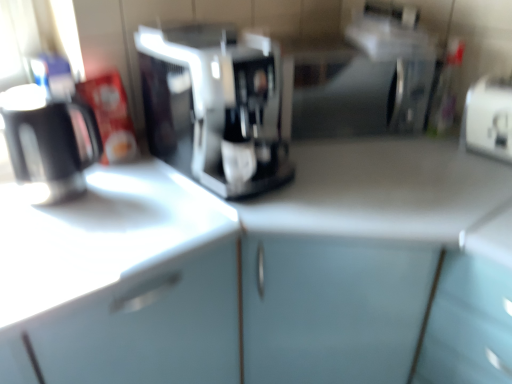
You are a GUI agent. You are given a task and a screenshot of the screen. Output one action in this format:
    pyautogui.click(x=<x>, y=<y>)
    Task: Click on the free location to the left of white plastic toaster at right
    This screenshot has width=512, height=384.
    Given the screenshot: What is the action you would take?
    coord(436,151)